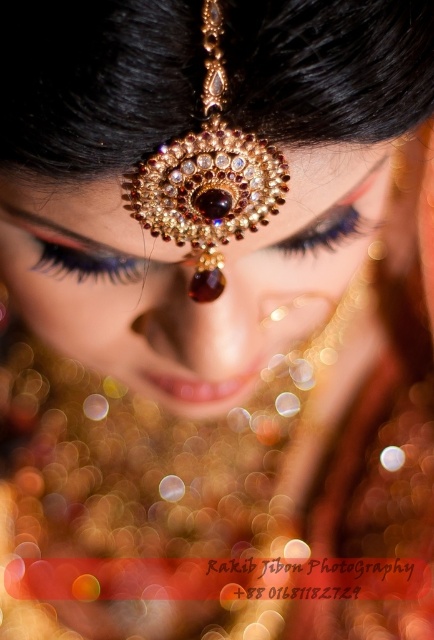
Is gold textured forehead ornament at center bigger than black matte eyelashes at upper left?

Yes.

What do you see at coordinates (325, 200) in the screenshot?
I see `gold textured forehead ornament at center` at bounding box center [325, 200].

Find the location of `gold textured forehead ornament at center`. gold textured forehead ornament at center is located at coordinates (325, 200).

Is the position of gold textured forehead ornament at center more distant than that of blue eyelashes at center?

That is False.

The height and width of the screenshot is (640, 434). I want to click on gold textured forehead ornament at center, so tap(325, 200).

You are a GUI agent. You are given a task and a screenshot of the screen. Output one action in this format:
    pyautogui.click(x=<x>, y=<y>)
    Task: Click on the gold textured forehead ornament at center
    
    Given the screenshot: What is the action you would take?
    pyautogui.click(x=325, y=200)

Does gold textured jewelry at center have a greater width compared to gold textured forehead ornament at center?

Yes, gold textured jewelry at center is wider than gold textured forehead ornament at center.

Can you confirm if gold textured jewelry at center is shorter than gold textured forehead ornament at center?

Incorrect, gold textured jewelry at center's height does not fall short of gold textured forehead ornament at center's.

The image size is (434, 640). Describe the element at coordinates (187, 276) in the screenshot. I see `gold textured jewelry at center` at that location.

Locate an element on the screen. This screenshot has width=434, height=640. gold textured jewelry at center is located at coordinates (187, 276).